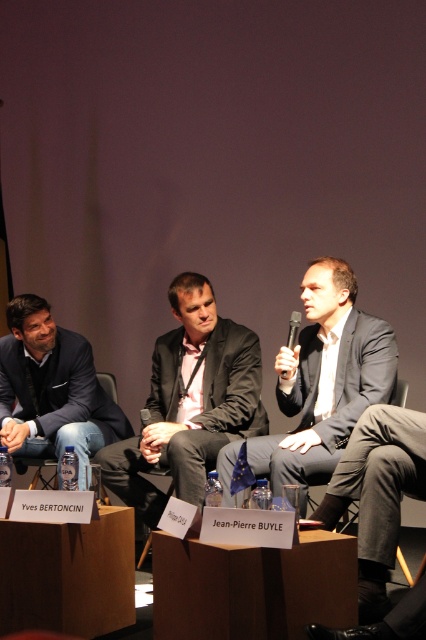
Is the position of dark gray suit at center more distant than that of black plastic microphone at center?

That is False.

Who is shorter, dark gray suit at center or black plastic microphone at center?

With less height is black plastic microphone at center.

Measure the distance between point [201,458] and camera.

A distance of 10.46 feet exists between point [201,458] and camera.

This screenshot has height=640, width=426. In order to click on dark gray suit at center in this screenshot , I will do `click(218, 408)`.

Is matte black suit at center to the left of black plastic microphone at center from the viewer's perspective?

No, matte black suit at center is not to the left of black plastic microphone at center.

Can you confirm if matte black suit at center is shorter than black plastic microphone at center?

No, matte black suit at center is not shorter than black plastic microphone at center.

Is point (238, 449) closer to viewer compared to point (296, 324)?

Yes.

You are a GUI agent. You are given a task and a screenshot of the screen. Output one action in this format:
    pyautogui.click(x=<x>, y=<y>)
    Task: Click on the matte black suit at center
    The width and height of the screenshot is (426, 640).
    Given the screenshot: What is the action you would take?
    pyautogui.click(x=328, y=397)

Which is below, dark gray suit at center or matte black suit at center?

dark gray suit at center is lower down.

Does point (256, 356) come in front of point (324, 458)?

That is False.

Which is in front, point (264, 426) or point (322, 362)?

Point (322, 362) is in front.

The width and height of the screenshot is (426, 640). I want to click on dark gray suit at center, so click(218, 408).